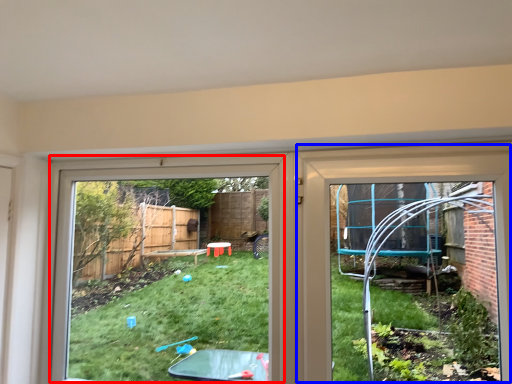
Question: Among these objects, which one is nearest to the camera, bay window (highlighted by a red box) or door (highlighted by a blue box)?

Choices:
 (A) bay window
 (B) door

Answer: (B)